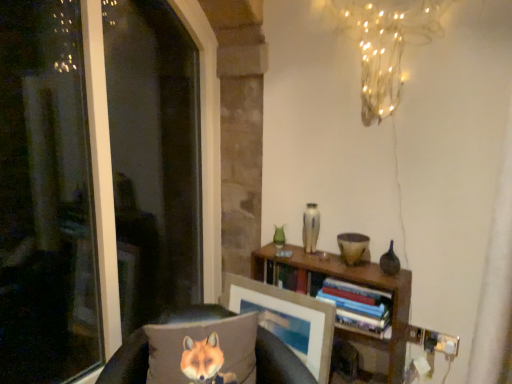
Question: Is brown fabric pillow at lower left located outside textured gray pillow with fox print at lower left?

Choices:
 (A) no
 (B) yes

Answer: (B)

Question: From a real-world perspective, is brown fabric pillow at lower left physically above textured gray pillow with fox print at lower left?

Choices:
 (A) yes
 (B) no

Answer: (B)

Question: Is brown fabric pillow at lower left looking in the opposite direction of textured gray pillow with fox print at lower left?

Choices:
 (A) yes
 (B) no

Answer: (A)

Question: Does brown fabric pillow at lower left have a greater height compared to textured gray pillow with fox print at lower left?

Choices:
 (A) no
 (B) yes

Answer: (B)

Question: Can textured gray pillow with fox print at lower left be found inside brown fabric pillow at lower left?

Choices:
 (A) yes
 (B) no

Answer: (A)

Question: Relative to textured gray pillow with fox print at lower left, is hardcover books at center in front or behind?

Choices:
 (A) front
 (B) behind

Answer: (B)

Question: In terms of size, does hardcover books at center appear bigger or smaller than textured gray pillow with fox print at lower left?

Choices:
 (A) big
 (B) small

Answer: (B)

Question: Considering the relative positions of hardcover books at center and textured gray pillow with fox print at lower left in the image provided, is hardcover books at center to the left or to the right of textured gray pillow with fox print at lower left?

Choices:
 (A) right
 (B) left

Answer: (A)

Question: Is point (333, 292) closer or farther from the camera than point (214, 337)?

Choices:
 (A) closer
 (B) farther

Answer: (B)

Question: In terms of width, does textured gray pillow with fox print at lower left look wider or thinner when compared to brown fabric pillow at lower left?

Choices:
 (A) wide
 (B) thin

Answer: (B)

Question: Is point (223, 372) positioned closer to the camera than point (135, 339)?

Choices:
 (A) closer
 (B) farther

Answer: (A)

Question: Is textured gray pillow with fox print at lower left spatially inside brown fabric pillow at lower left, or outside of it?

Choices:
 (A) outside
 (B) inside

Answer: (B)

Question: In the image, is textured gray pillow with fox print at lower left on the left side or the right side of brown fabric pillow at lower left?

Choices:
 (A) right
 (B) left

Answer: (A)

Question: Based on their positions, is transparent glass window at left located to the left or right of illuminated wire at upper center?

Choices:
 (A) left
 (B) right

Answer: (A)

Question: Does point (14, 165) appear closer or farther from the camera than point (433, 6)?

Choices:
 (A) farther
 (B) closer

Answer: (A)